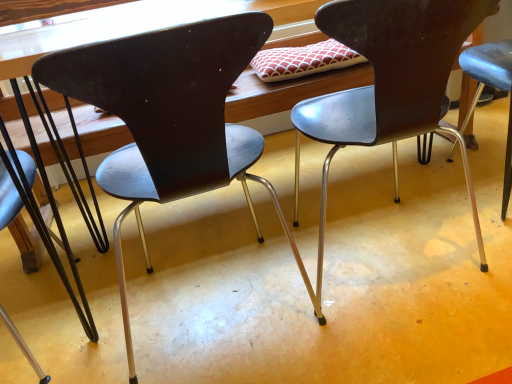
Where is `free space between metallic black chair at center, which is the 3th chair from left to right, and matte black chair at center, the second chair positioned from the left`? free space between metallic black chair at center, which is the 3th chair from left to right, and matte black chair at center, the second chair positioned from the left is located at coordinates (362, 270).